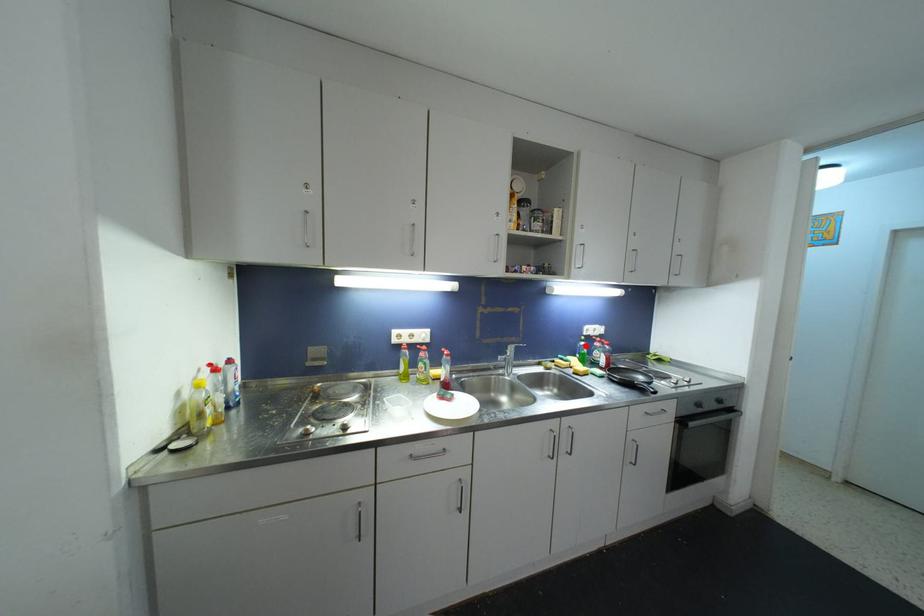
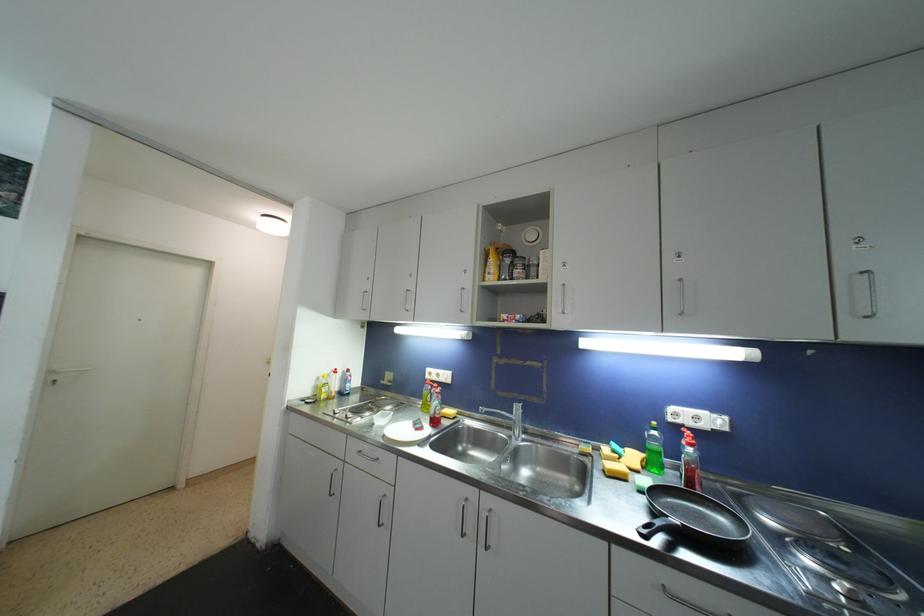
The point at the highlighted location is marked in the first image. Where is the corresponding point in the second image?

(658, 436)